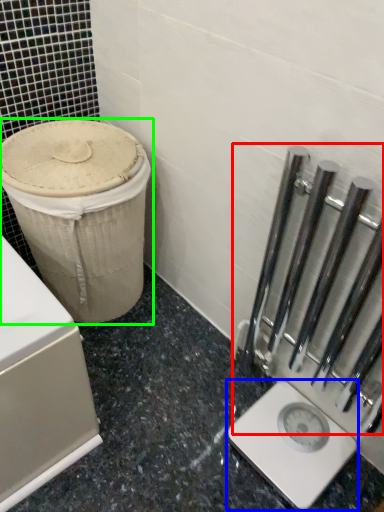
Question: Estimate the real-world distances between objects in this image. Which object is closer to rail (highlighted by a red box), scale (highlighted by a blue box) or waste container (highlighted by a green box)?

Choices:
 (A) scale
 (B) waste container

Answer: (A)